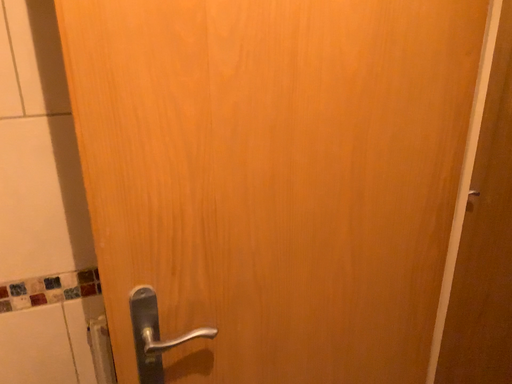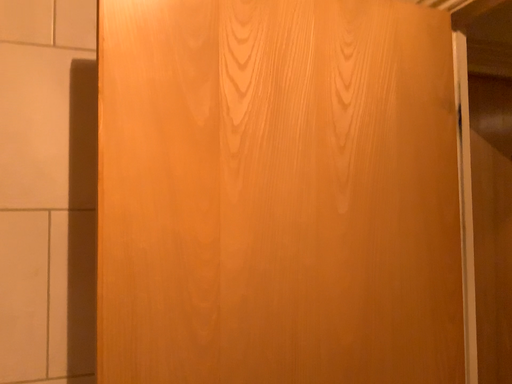
Question: Which way did the camera rotate in the video?

Choices:
 (A) rotated downward
 (B) rotated upward

Answer: (B)